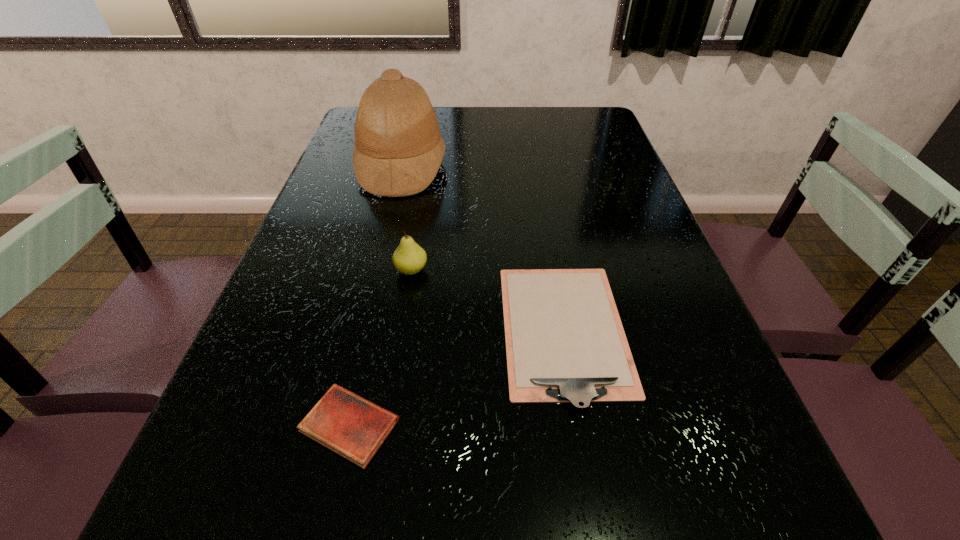
Where is `hat`? The width and height of the screenshot is (960, 540). hat is located at coordinates (398, 150).

This screenshot has height=540, width=960. I want to click on the farthest object, so click(x=398, y=150).

The width and height of the screenshot is (960, 540). I want to click on pear, so click(x=409, y=258).

Where is `clipboard`? The width and height of the screenshot is (960, 540). clipboard is located at coordinates (565, 342).

You are a GUI agent. You are given a task and a screenshot of the screen. Output one action in this format:
    pyautogui.click(x=<x>, y=<y>)
    Task: Click on the rightmost object
    
    Given the screenshot: What is the action you would take?
    pyautogui.click(x=565, y=342)

In order to click on diary in this screenshot , I will do `click(351, 426)`.

Image resolution: width=960 pixels, height=540 pixels. Find the location of `free spot located 0.090m on the front-facing side of the tallest object`. free spot located 0.090m on the front-facing side of the tallest object is located at coordinates (477, 166).

Identify the location of vacant region located 0.240m on the right of the pear. (538, 270).

Identify the location of vacant region located 0.100m on the front of the rightmost object. (x=589, y=477).

You are a GUI agent. You are given a task and a screenshot of the screen. Output one action in this format:
    pyautogui.click(x=<x>, y=<y>)
    Task: Click on the vacant space located 0.130m on the left of the shortest object
    The height and width of the screenshot is (540, 960).
    Given the screenshot: What is the action you would take?
    pyautogui.click(x=219, y=425)